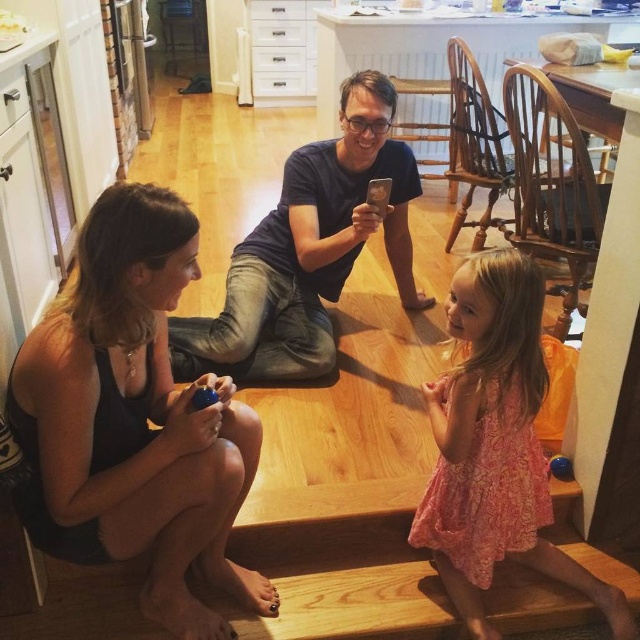
You are standing in the kitchen and want to place two decorative items at the coordinates point [268,605] and point [477,515]. If you are facing the kitchen entrance, which coordinate is closer to the back wall?

Point [268,605] is behind point [477,515], so it is closer to the back wall.

You are a photographer trying to capture the perfect shot of the pink lace dress at center and the dark blue shirt at center. Which one should you focus on first if you want to include both in your frame?

The pink lace dress at center is positioned on the right side of dark blue shirt at center, so you should focus on the dark blue shirt at center first to ensure both are in frame.

You are standing in the kitchen and see the black matte tank top at lower left and the dark blue shirt at center. Which one is positioned more to the left side of the scene?

The black matte tank top at lower left is positioned more to the left side of the scene than the dark blue shirt at center.